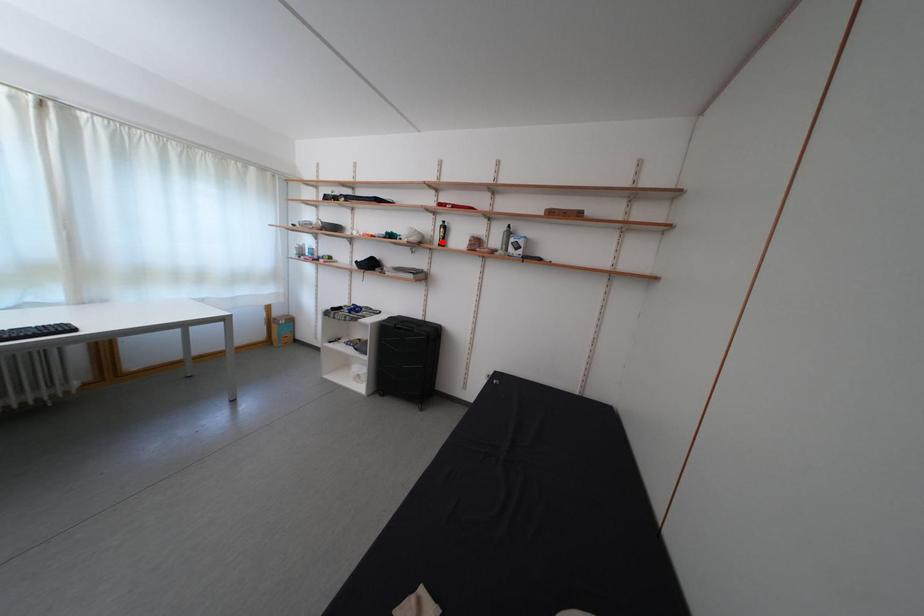
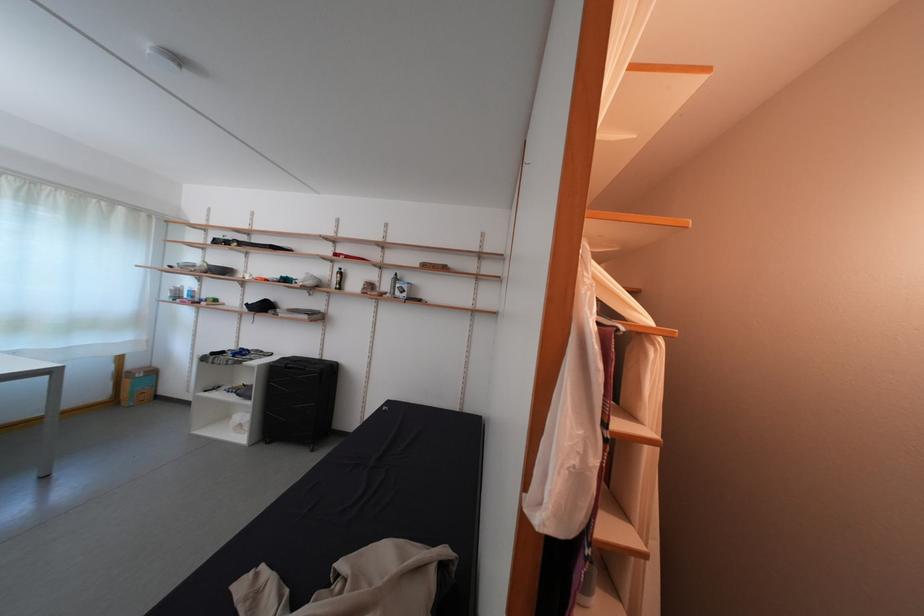
Where in the second image is the point corresponding to the highlighted location from the first image?

(339, 286)